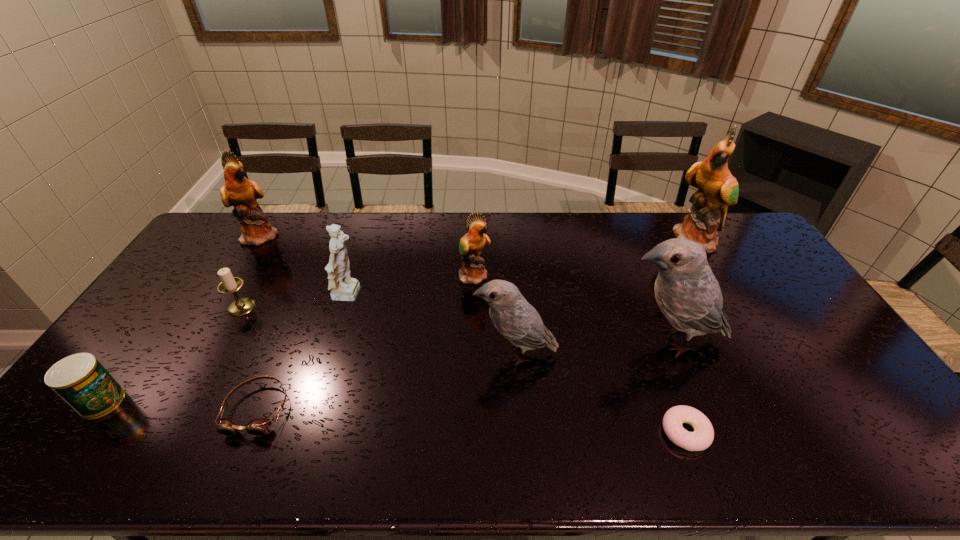
At what (x,y) coordinates should I click in order to perform the action: click on goggles that is at the near edge. Please return your answer as a coordinate pair (x, y). The width and height of the screenshot is (960, 540). Looking at the image, I should click on (258, 427).

Image resolution: width=960 pixels, height=540 pixels. I want to click on doughnut at the near edge, so click(702, 437).

You are a GUI agent. You are given a task and a screenshot of the screen. Output one action in this format:
    pyautogui.click(x=<x>, y=<y>)
    Task: Click on the parrot that is positioned at the left edge
    This screenshot has height=540, width=960.
    Given the screenshot: What is the action you would take?
    pyautogui.click(x=238, y=191)

Where is `can that is at the left edge`? The height and width of the screenshot is (540, 960). can that is at the left edge is located at coordinates (80, 380).

The width and height of the screenshot is (960, 540). I want to click on object that is positioned at the right edge, so click(x=717, y=188).

Where is `object present at the far left corner`? Image resolution: width=960 pixels, height=540 pixels. object present at the far left corner is located at coordinates (238, 191).

The image size is (960, 540). What are the coordinates of `object that is at the far right corner` in the screenshot? It's located at (717, 188).

You are a GUI agent. You are given a task and a screenshot of the screen. Output one action in this format:
    pyautogui.click(x=<x>, y=<y>)
    Task: Click on the vacant space at the far edge of the desktop
    This screenshot has width=960, height=540.
    Given the screenshot: What is the action you would take?
    pyautogui.click(x=481, y=212)

Locate an element on the screen. The image size is (960, 540). free point at the near edge is located at coordinates (781, 468).

Image resolution: width=960 pixels, height=540 pixels. What are the coordinates of `free location at the right edge of the desktop` in the screenshot? It's located at (888, 411).